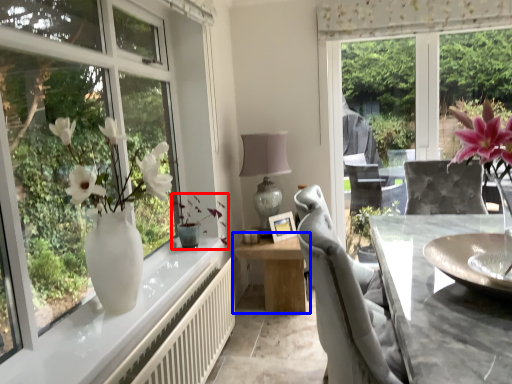
Question: Among these objects, which one is farthest to the camera, plant (highlighted by a red box) or table (highlighted by a blue box)?

Choices:
 (A) plant
 (B) table

Answer: (B)